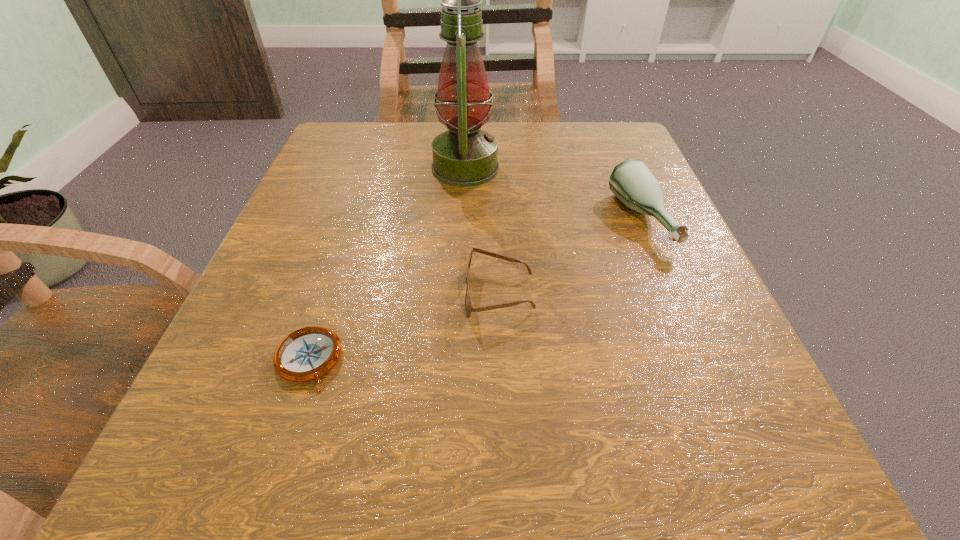
At what (x,y) coordinates should I click in order to perform the action: click on vacant space located 0.250m on the frames of the third farthest object. Please return your answer as a coordinate pair (x, y). This screenshot has height=540, width=960. Looking at the image, I should click on (294, 294).

Find the location of a particular element. The width and height of the screenshot is (960, 540). vacant space located on the frames of the third farthest object is located at coordinates (342, 294).

Where is `free spot located 0.190m on the back of the nearest object`? Image resolution: width=960 pixels, height=540 pixels. free spot located 0.190m on the back of the nearest object is located at coordinates (348, 240).

Where is `object present at the far edge`? Image resolution: width=960 pixels, height=540 pixels. object present at the far edge is located at coordinates (464, 156).

You are a GUI agent. You are given a task and a screenshot of the screen. Output one action in this format:
    pyautogui.click(x=<x>, y=<y>)
    Task: Click on the object located at the left edge
    
    Given the screenshot: What is the action you would take?
    pyautogui.click(x=306, y=354)

What are the coordinates of `object that is at the right edge` in the screenshot? It's located at (631, 181).

In the image, there is a desktop. Identify the location of vacant space at the far edge. This screenshot has height=540, width=960. (431, 124).

You are a GUI agent. You are given a task and a screenshot of the screen. Output one action in this format:
    pyautogui.click(x=<x>, y=<y>)
    Task: Click on the vacant space at the near edge of the desktop
    The image size is (960, 540).
    Given the screenshot: What is the action you would take?
    pyautogui.click(x=494, y=494)

The width and height of the screenshot is (960, 540). In the image, there is a desktop. Identify the location of blank space at the left edge. (322, 290).

The width and height of the screenshot is (960, 540). In order to click on vacant space at the right edge of the desktop in this screenshot , I will do `click(690, 418)`.